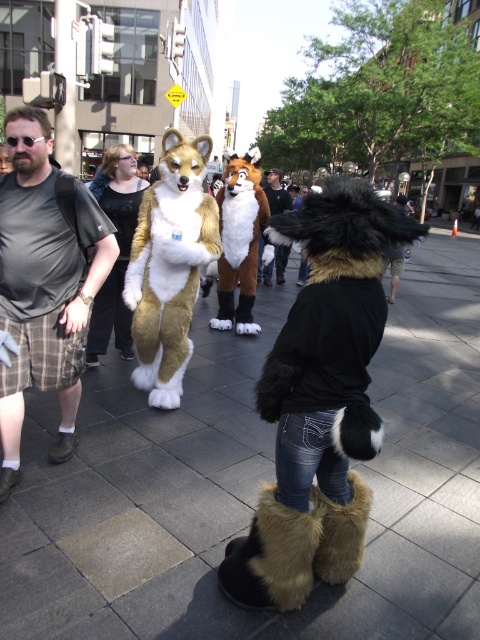
You are holding a camera and want to take a photo of the fuzzy brown and white fox at center. If the camera has a maximum focus range of 4 meters, will you be able to capture the fox clearly?

The fuzzy brown and white fox at center and camera are 4.08 meters apart from each other. Since the camera can only focus up to 4 meters, the distance is slightly beyond the camera maximum range, so the photo may not be clear.

You are standing in the urban street scene described. You see a point marked at coordinates [169,266]. Which object from the scene does this point belong to?

The point at coordinates [169,266] belongs to the fuzzy brown and white fox at center.

You are a photographer trying to capture a group photo of the brown plush fox at center and the plaid cotton shorts at lower left. If you want to ensure both subjects are fully visible in the frame, which subject should you focus on to avoid cropping either of them?

The brown plush fox at center is wider than the plaid cotton shorts at lower left, so focusing on the brown plush fox at center ensures both subjects are fully visible without cropping.